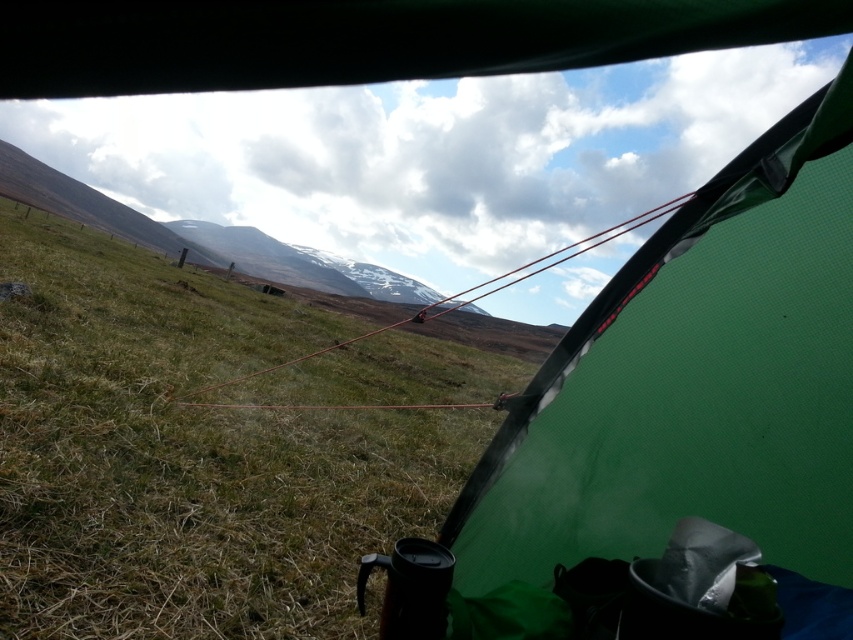
Question: Which of the following is the farthest from the observer?

Choices:
 (A) green mesh tent at center
 (B) green grassy at lower left

Answer: (B)

Question: Can you confirm if green grassy at lower left is positioned above green mesh tent at center?

Choices:
 (A) no
 (B) yes

Answer: (B)

Question: Which point is closer to the camera?

Choices:
 (A) green grassy at lower left
 (B) green mesh tent at center

Answer: (B)

Question: Is green grassy at lower left to the right of green mesh tent at center from the viewer's perspective?

Choices:
 (A) no
 (B) yes

Answer: (A)

Question: Which point is farther from the camera taking this photo?

Choices:
 (A) (809, 104)
 (B) (111, 413)

Answer: (B)

Question: Is green grassy at lower left below green mesh tent at center?

Choices:
 (A) no
 (B) yes

Answer: (A)